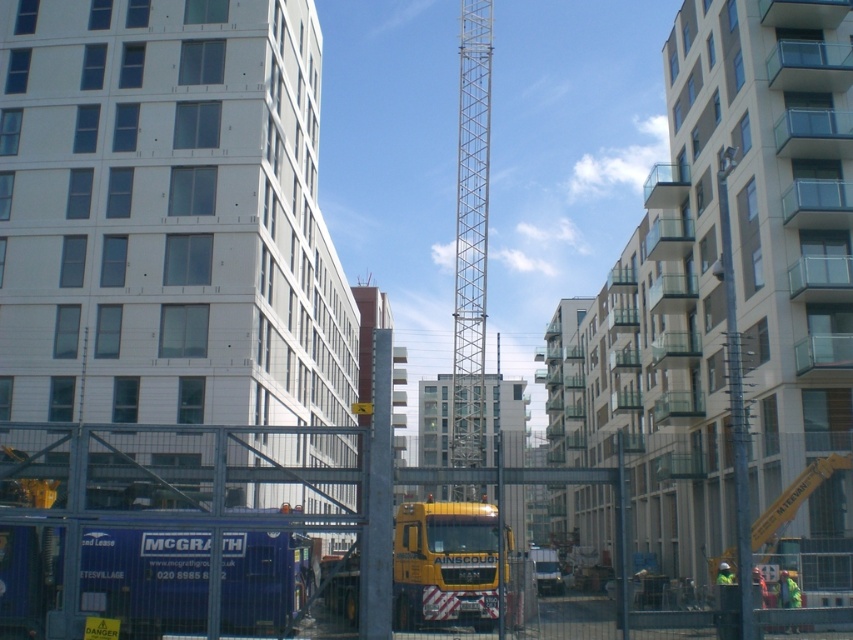
Is metallic silver crane at center positioned before yellow metallic truck at center?

Yes, it is.

Looking at this image, which is more to the right, metallic silver crane at center or yellow metallic truck at center?

metallic silver crane at center

Does point (466, 496) come closer to viewer compared to point (448, 554)?

That is True.

This screenshot has width=853, height=640. I want to click on metallic silver crane at center, so click(x=471, y=234).